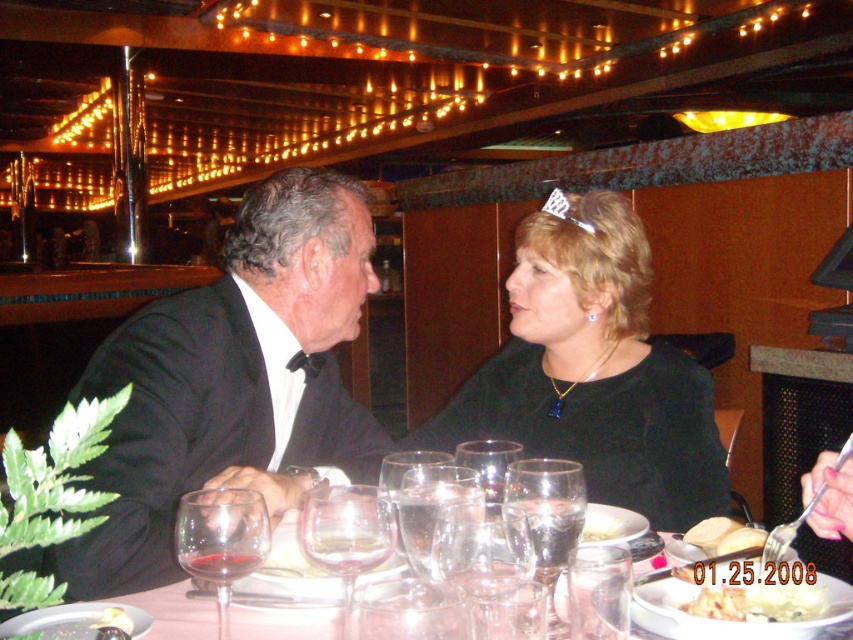
You are a waiter in a restaurant and you see the red glass wine at center and the white creamy pasta at center on the table. Which one is located to the left?

The red glass wine at center is to the left of the white creamy pasta at center.

You are a waiter in a restaurant and need to place a new dish between the two points, point (416,488) and point (619,518). Based on their positions, which point should the dish be closer to if it needs to be placed in front of both?

The dish should be placed closer to point (416,488) because it is in front of point (619,518). Since it needs to be in front of both, positioning it near the frontmost point ensures visibility and accessibility.

You are a waiter in a restaurant. You need to place a 12 inch long decorative ribbon between the clear glass wine glass at table center and the white bread at center. Is there enough space to place the ribbon without moving either item?

The clear glass wine glass at table center is 14.40 inches from the white bread at center. Since the ribbon is 12 inches long, there is enough space to place it between them without moving either item.